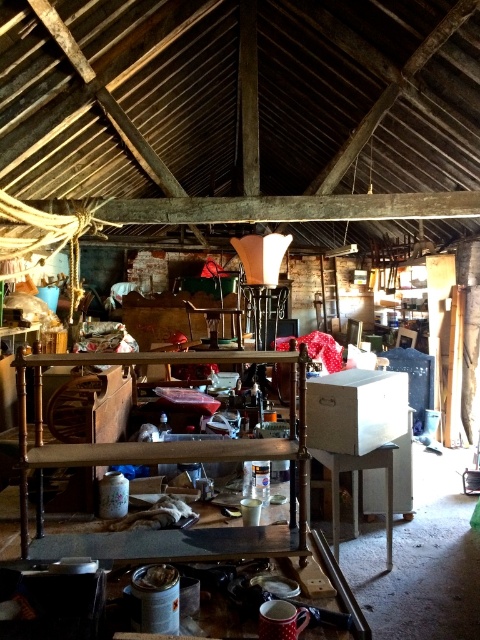
You are standing in the center of the room and want to place a small potted plant on the wooden shelf at center. According to the image, where exactly should you place the plant?

The wooden shelf at center is located at point 2D coordinates (160, 461), so place the plant there.

Looking at this image, you are organizing items in a rustic room and need to place a large box on the wooden shelf at center. However, there is a white glossy table at center nearby. Which object should you place the box on to ensure it is on the left side of the table?

The wooden shelf at center is positioned on the left side of the white glossy table at center, so placing the large box on the wooden shelf at center will ensure it is on the left side of the table.